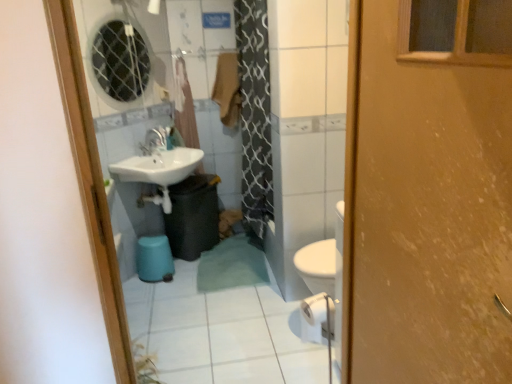
You are a GUI agent. You are given a task and a screenshot of the screen. Output one action in this format:
    pyautogui.click(x=<x>, y=<y>)
    Task: Click on the free point to the right of matte white faucet at center
    
    Given the screenshot: What is the action you would take?
    pyautogui.click(x=182, y=153)